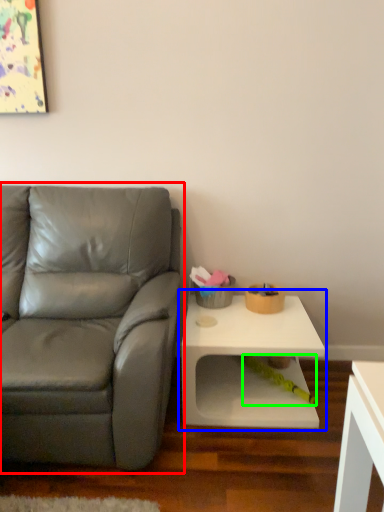
Question: Which object is the farthest from studio couch (highlighted by a red box)? Choose among these: table (highlighted by a blue box) or toy (highlighted by a green box).

Choices:
 (A) table
 (B) toy

Answer: (B)